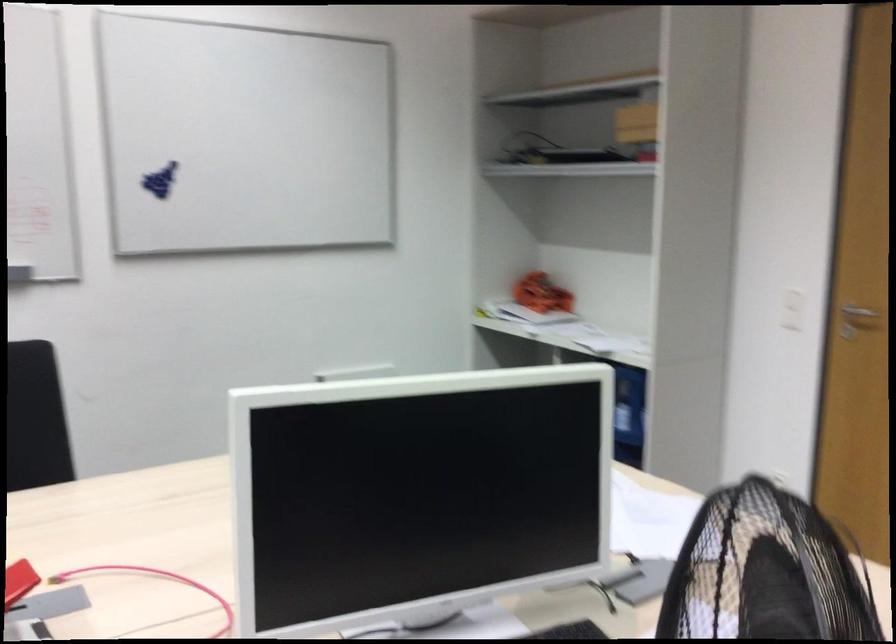
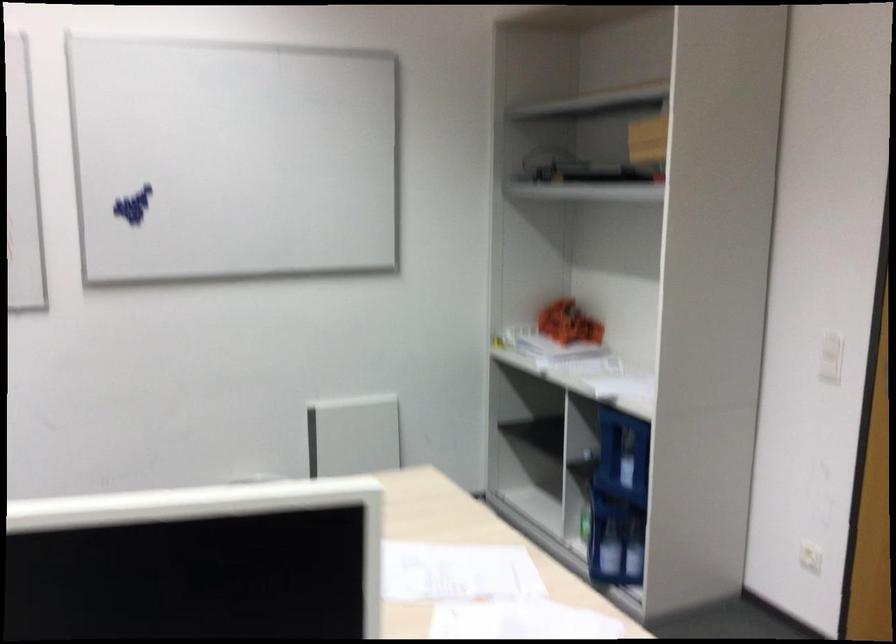
Where in the second image is the point corresponding to [788,313] from the first image?

(830, 357)